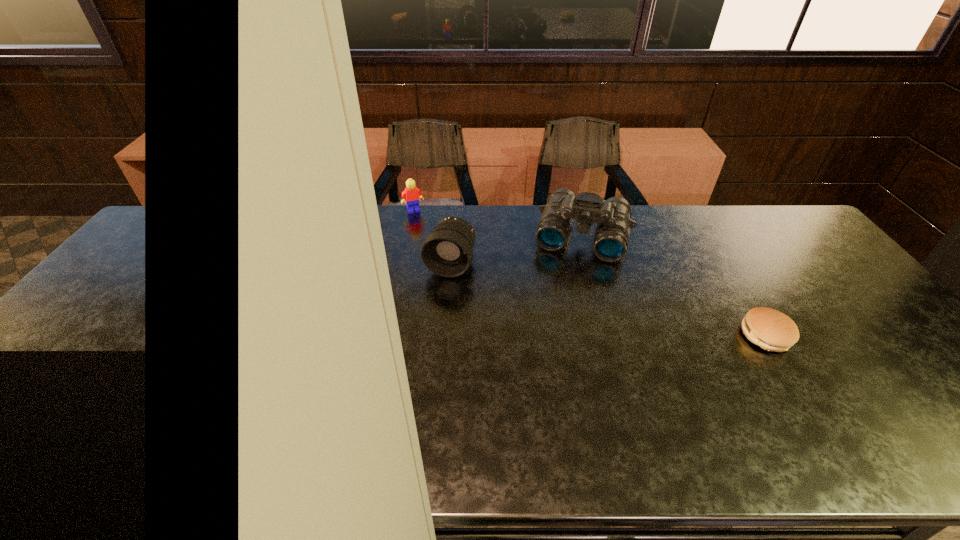
What are the coordinates of `blank space located 0.260m on the front-facing side of the leftmost object` in the screenshot? It's located at (440, 257).

Identify the location of vacant region located 0.350m on the front-facing side of the leftmost object. The width and height of the screenshot is (960, 540). (448, 275).

Locate an element on the screen. This screenshot has height=540, width=960. vacant space situated on the front-facing side of the leftmost object is located at coordinates (423, 226).

The image size is (960, 540). Identify the location of vacant space located 0.370m through the lenses of the binoculars. (552, 356).

Locate an element on the screen. The image size is (960, 540). vacant space located through the lenses of the binoculars is located at coordinates (565, 300).

This screenshot has width=960, height=540. What are the coordinates of `vacant space situated through the lenses of the binoculars` in the screenshot? It's located at (557, 336).

I want to click on Lego located at the far edge, so click(412, 194).

Identify the location of binoculars situated at the far edge. The image size is (960, 540). (612, 216).

Locate an element on the screen. The width and height of the screenshot is (960, 540). vacant position at the far edge of the desktop is located at coordinates (630, 243).

You are a GUI agent. You are given a task and a screenshot of the screen. Output one action in this format:
    pyautogui.click(x=<x>, y=<y>)
    Task: Click on the free space at the near edge of the desktop
    Image resolution: width=960 pixels, height=540 pixels.
    Given the screenshot: What is the action you would take?
    pyautogui.click(x=250, y=409)